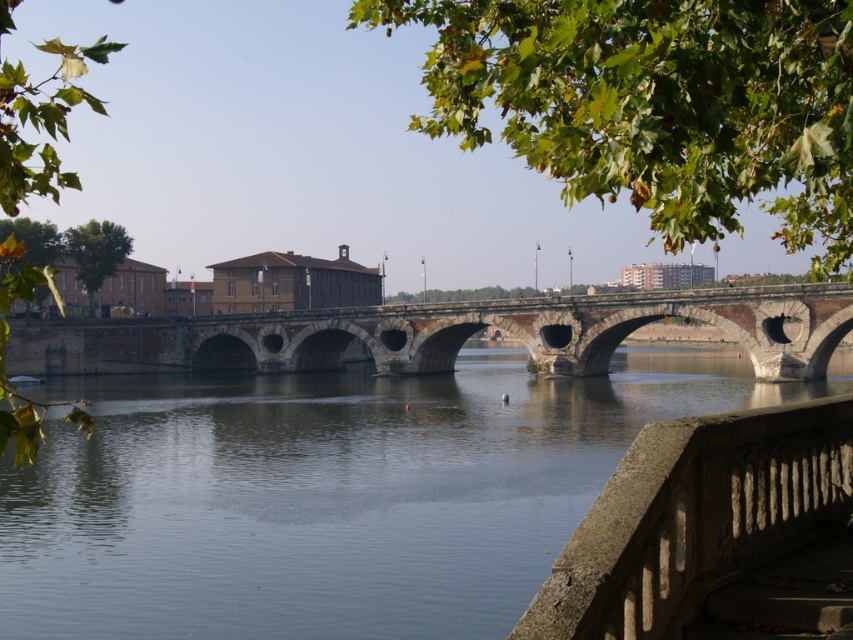
Question: Is clear water at bridge center to the right of gray stone balustrade at lower right from the viewer's perspective?

Choices:
 (A) yes
 (B) no

Answer: (B)

Question: Among these objects, which one is farthest from the camera?

Choices:
 (A) gray stone balustrade at lower right
 (B) clear water at bridge center

Answer: (B)

Question: Which point is closer to the camera?

Choices:
 (A) gray stone balustrade at lower right
 (B) clear water at bridge center

Answer: (A)

Question: Can you confirm if clear water at bridge center is positioned above brown stone bridge at center?

Choices:
 (A) no
 (B) yes

Answer: (A)

Question: Which point is closer to the camera taking this photo?

Choices:
 (A) (683, 364)
 (B) (694, 577)

Answer: (B)

Question: Considering the relative positions of clear water at bridge center and brown stone bridge at center in the image provided, where is clear water at bridge center located with respect to brown stone bridge at center?

Choices:
 (A) below
 (B) above

Answer: (A)